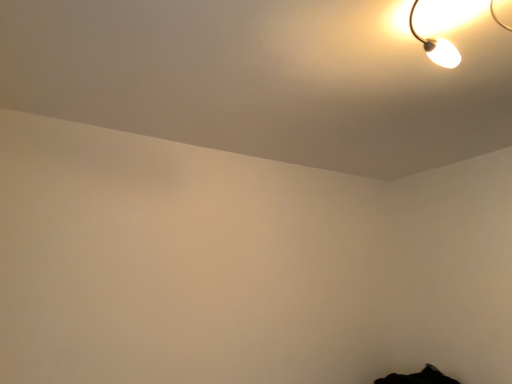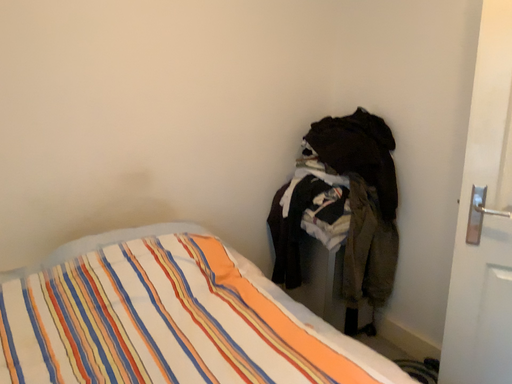
Question: Which way did the camera rotate in the video?

Choices:
 (A) rotated downward
 (B) rotated upward

Answer: (A)